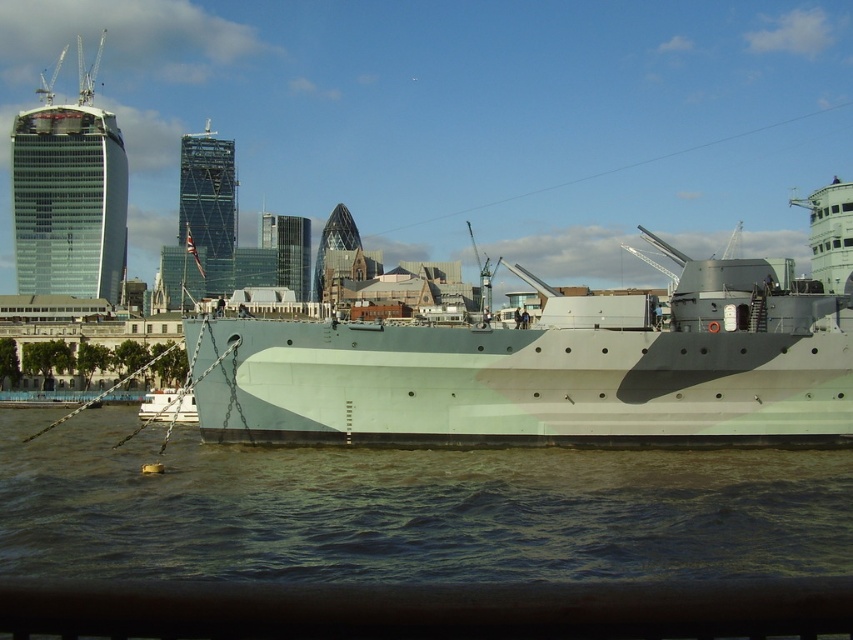
Is greenish water at lower center behind white matte boat at lower left?

No, greenish water at lower center is in front of white matte boat at lower left.

Is greenish water at lower center thinner than white matte boat at lower left?

Incorrect, greenish water at lower center's width is not less than white matte boat at lower left's.

Is point (552, 538) closer to viewer compared to point (148, 417)?

That is True.

Locate an element on the screen. This screenshot has height=640, width=853. greenish water at lower center is located at coordinates (408, 509).

Between greenish water at lower center and light gray metallic ship at center, which one is positioned lower?

Positioned lower is greenish water at lower center.

Is greenish water at lower center further to camera compared to light gray metallic ship at center?

No, it is in front of light gray metallic ship at center.

Who is more distant from viewer, (231, 484) or (503, 372)?

The point (503, 372) is behind.

Find the location of a particular element. The width and height of the screenshot is (853, 640). greenish water at lower center is located at coordinates (408, 509).

Does light gray metallic ship at center appear under white matte boat at lower left?

Incorrect, light gray metallic ship at center is not positioned below white matte boat at lower left.

Between point (836, 301) and point (144, 419), which one is positioned in front?

Point (836, 301) is in front.

Locate an element on the screen. The image size is (853, 640). light gray metallic ship at center is located at coordinates (546, 371).